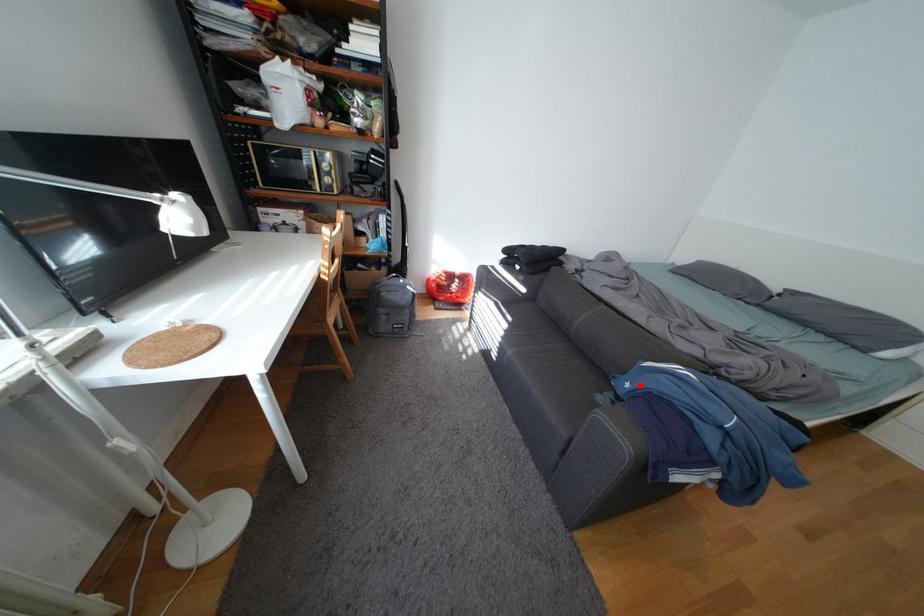
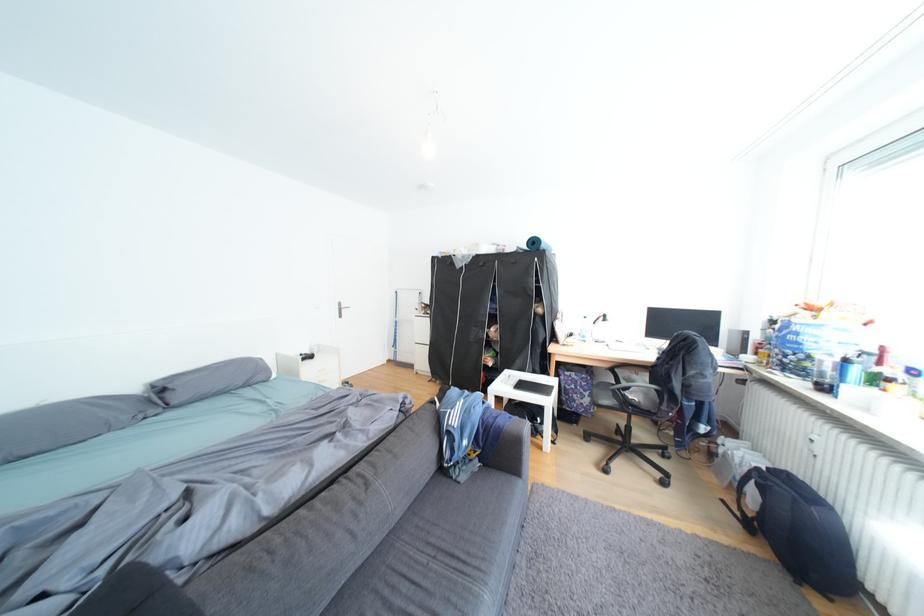
Locate, in the second image, the point that corresponds to the highlighted location in the first image.

(478, 444)